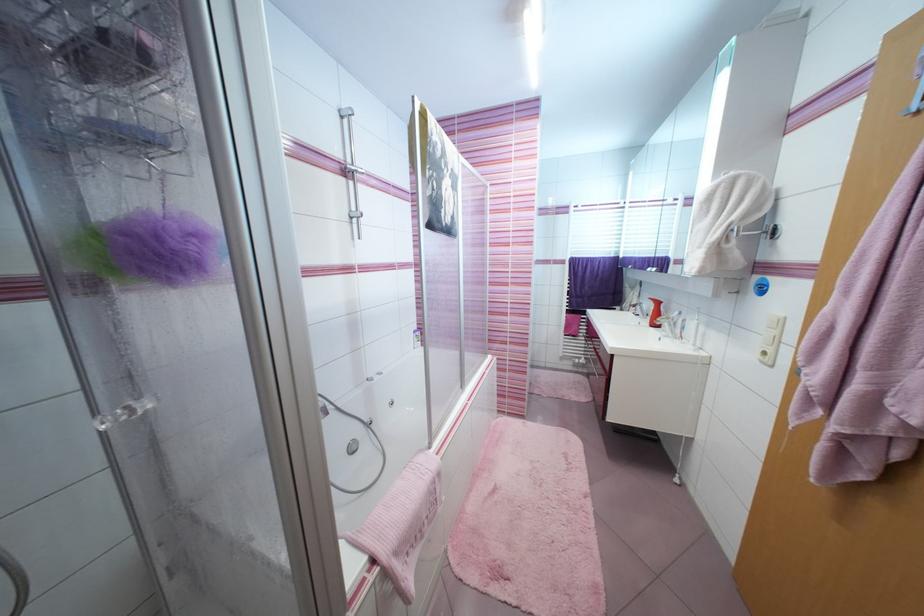
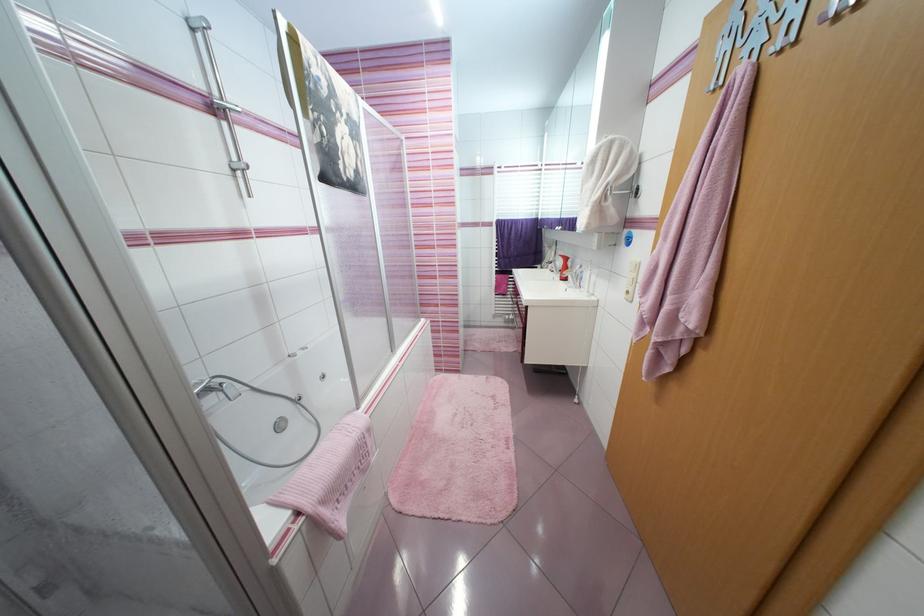
The point at (x=358, y=450) is marked in the first image. Where is the corresponding point in the second image?

(286, 428)